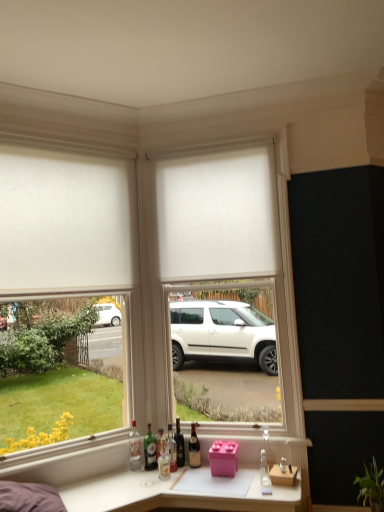
In order to click on free space in front of clear glass bottle at lower left, positioned as the seventh bottle in right-to-left order in this screenshot , I will do `click(131, 477)`.